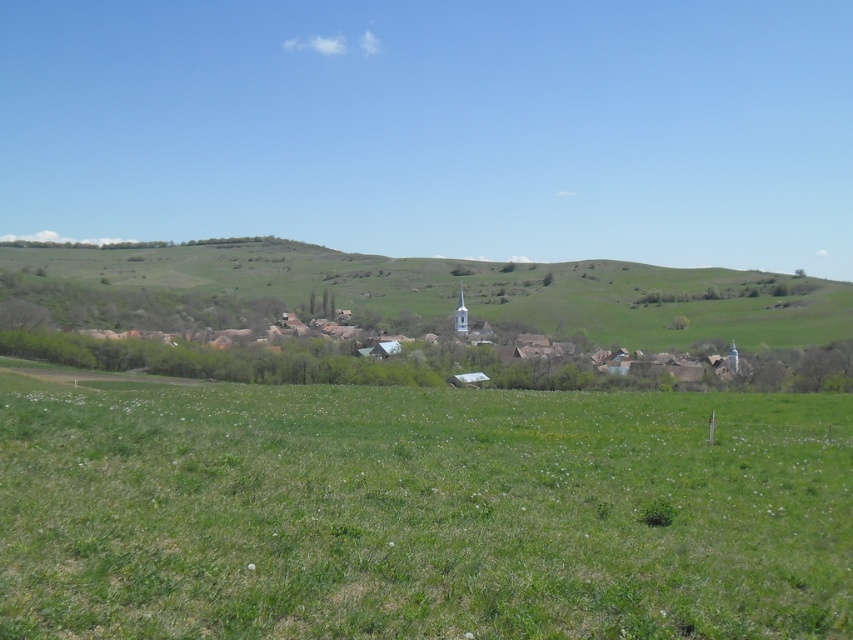
You are standing at the origin point in the image. Which direction should you move to reach the green grass pasture at center?

The green grass pasture at center is located at point (x=421, y=513), so you should move towards the right and slightly upwards from the origin point to reach it.

You are a drone operator planning to fly a drone over the green grass pasture at center and the white wooden houses at center. Which area would require a lower altitude to capture the entire area in one photo?

The green grass pasture at center is thinner than the white wooden houses at center, so to capture the entire area of the green grass pasture at center, the drone would need to fly at a lower altitude compared to the white wooden houses at center.